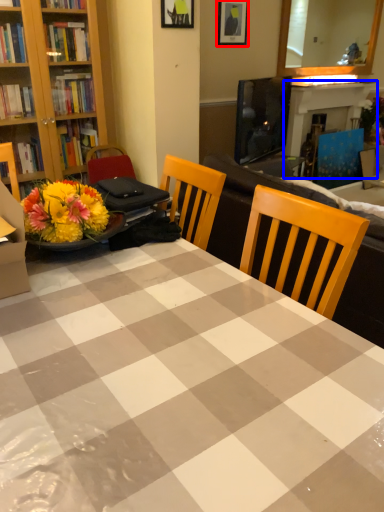
Question: Among these objects, which one is farthest to the camera, picture frame (highlighted by a red box) or fireplace (highlighted by a blue box)?

Choices:
 (A) picture frame
 (B) fireplace

Answer: (B)